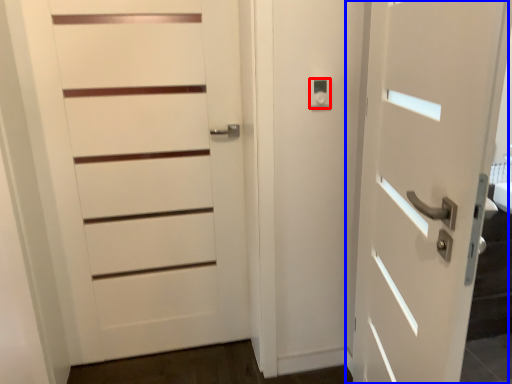
Question: Which object is closer to the camera taking this photo, knob (highlighted by a red box) or door (highlighted by a blue box)?

Choices:
 (A) knob
 (B) door

Answer: (B)